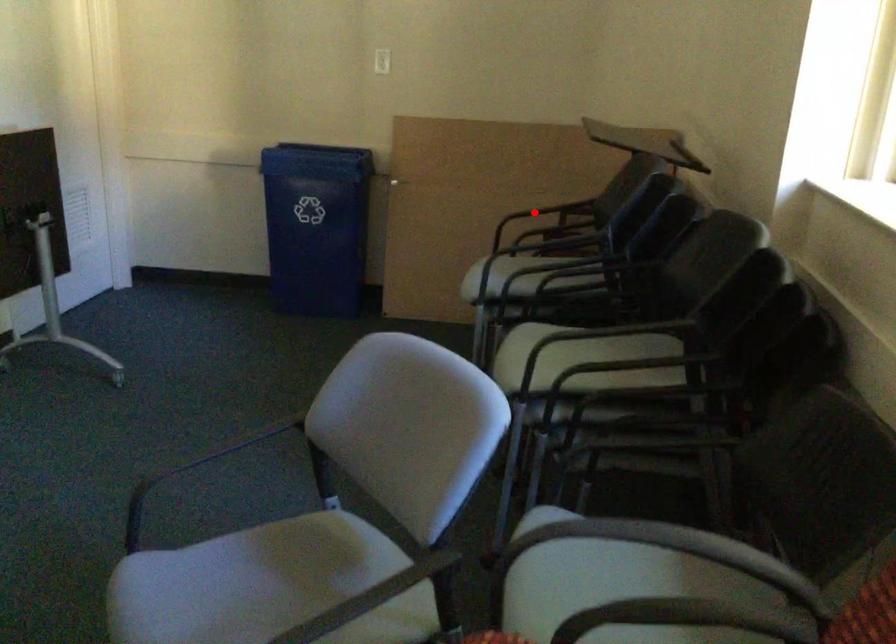
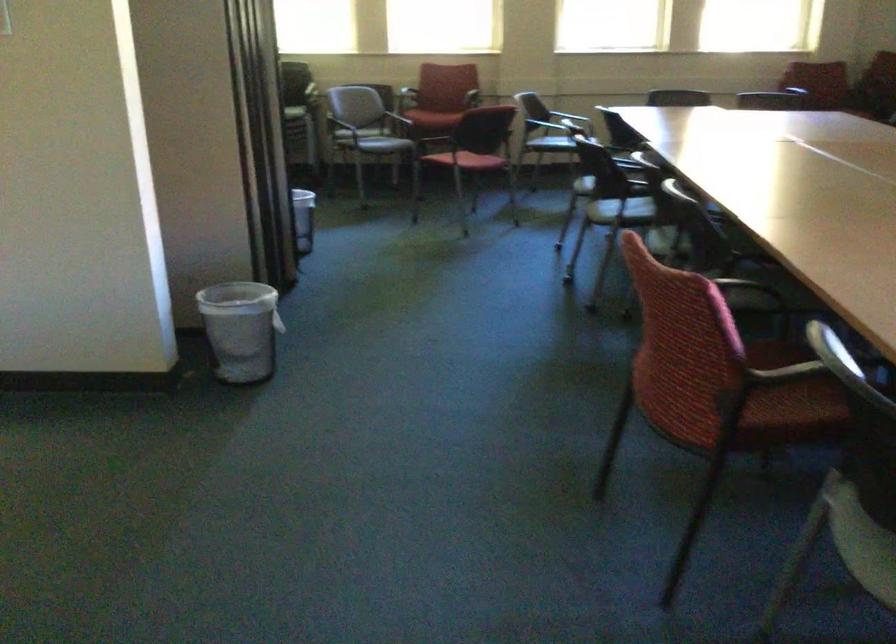
Question: I am providing you with two images of the same scene from different viewpoints. A red point is marked on the first image. Can you still see the location of the red point in image 2?

Choices:
 (A) Yes
 (B) No

Answer: (B)